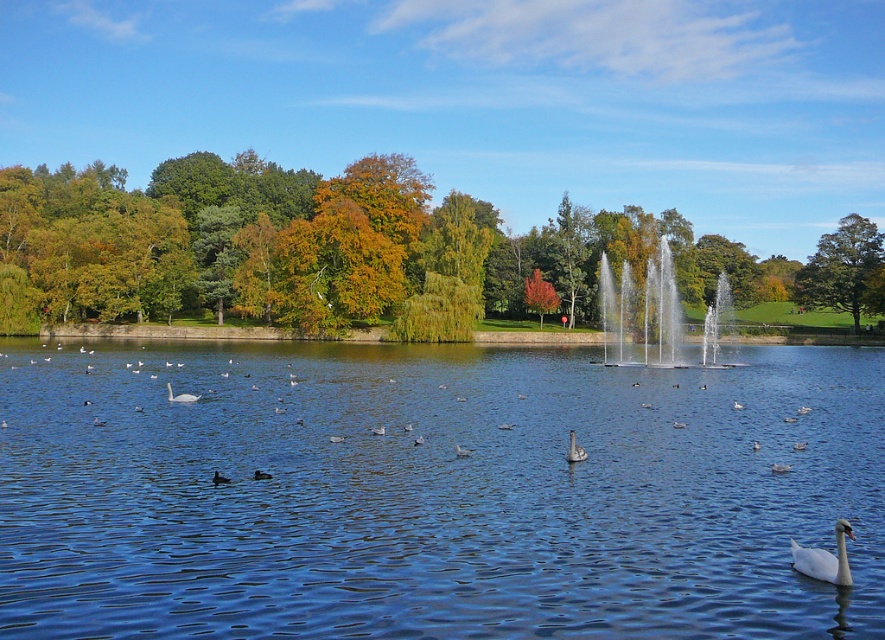
Between white matte goose at center and brown matte duck at lower center, which one has more height?

Standing taller between the two is white matte goose at center.

Does point (573, 442) lie in front of point (218, 483)?

No, it is not.

This screenshot has width=885, height=640. Identify the location of white matte goose at center. (574, 449).

This screenshot has width=885, height=640. Identify the location of white matte goose at center. (574, 449).

Between transparent blue water at center and white glossy swan at lower right, which one is positioned higher?

white glossy swan at lower right

Is transparent blue water at center closer to the viewer compared to white glossy swan at lower right?

Yes, transparent blue water at center is closer to the viewer.

Is point (506, 451) more distant than point (791, 561)?

Yes, point (506, 451) is farther from viewer.

The height and width of the screenshot is (640, 885). In order to click on transparent blue water at center in this screenshot , I will do `click(433, 492)`.

Does clear glass water at center come behind orange leafy tree at center?

No.

Can you confirm if clear glass water at center is wider than orange leafy tree at center?

Indeed, clear glass water at center has a greater width compared to orange leafy tree at center.

What are the coordinates of `clear glass water at center` in the screenshot? It's located at (643, 314).